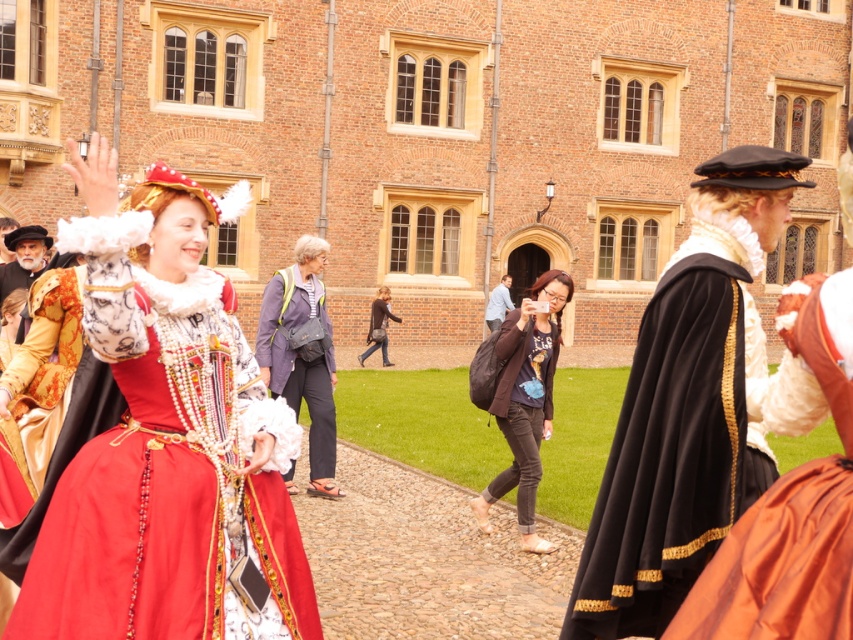
You are an artist sketching the scene in front of the grand brick building. You notice the matte gold hat at upper left and the smooth blue shirt at center. Which object should you draw first if you want to capture the one closer to the top of the page?

The matte gold hat at upper left should be drawn first because it is positioned higher up than the smooth blue shirt at center.

You are organizing a photo shoot and need to arrange two models wearing the dark brown leather jacket at center and smooth blue shirt at center side by side. Given their clothing widths, which model should stand closer to the camera to ensure both appear equally sized in the photo?

The model wearing the dark brown leather jacket at center should stand closer to the camera because its lesser width means positioning it nearer will help balance the apparent size with the wider smooth blue shirt at center.

You are a costume designer trying to fit a gray fabric jacket at center and denim jeans at center onto a mannequin. Which garment should you place first if you want to start with the wider one?

The denim jeans at center should be placed first since they are wider than the gray fabric jacket at center.